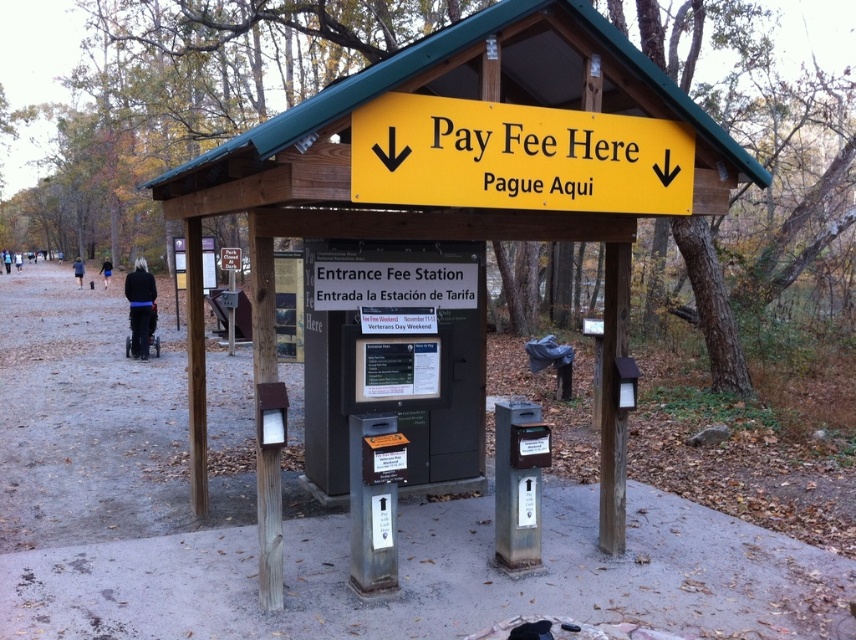
Question: Which point is farther to the camera?

Choices:
 (A) wooden sign at center
 (B) yellow matte sign at center

Answer: (A)

Question: Does wooden sign at center appear on the right side of yellow matte sign at center?

Choices:
 (A) no
 (B) yes

Answer: (B)

Question: Does wooden sign at center have a lesser width compared to yellow matte sign at center?

Choices:
 (A) no
 (B) yes

Answer: (A)

Question: Which point is closer to the camera?

Choices:
 (A) (274, 374)
 (B) (628, 195)

Answer: (A)

Question: Does wooden sign at center have a smaller size compared to yellow matte sign at center?

Choices:
 (A) no
 (B) yes

Answer: (A)